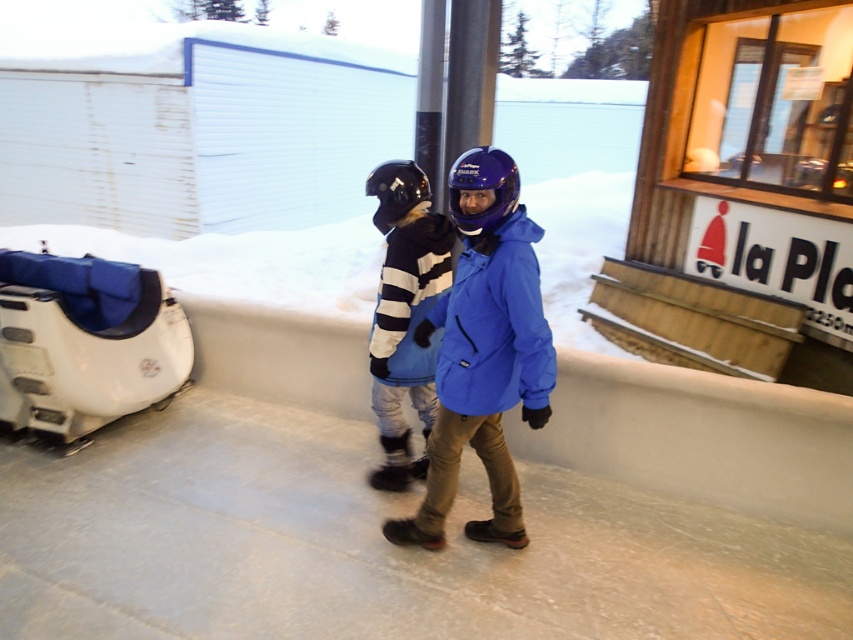
Question: Among these objects, which one is nearest to the camera?

Choices:
 (A) blue matte jacket at center
 (B) striped fleece jacket at center
 (C) blue fabric snowmobile at lower left

Answer: (A)

Question: Which object is positioned farthest from the blue fabric snowmobile at lower left?

Choices:
 (A) striped fleece jacket at center
 (B) blue matte jacket at center

Answer: (B)

Question: Which object is the farthest from the striped fleece jacket at center?

Choices:
 (A) blue fabric snowmobile at lower left
 (B) blue matte jacket at center

Answer: (A)

Question: Does blue matte jacket at center have a greater width compared to blue fabric snowmobile at lower left?

Choices:
 (A) no
 (B) yes

Answer: (A)

Question: Can you confirm if blue matte jacket at center is positioned to the right of blue fabric snowmobile at lower left?

Choices:
 (A) no
 (B) yes

Answer: (B)

Question: Can you confirm if blue fabric snowmobile at lower left is positioned below striped fleece jacket at center?

Choices:
 (A) no
 (B) yes

Answer: (A)